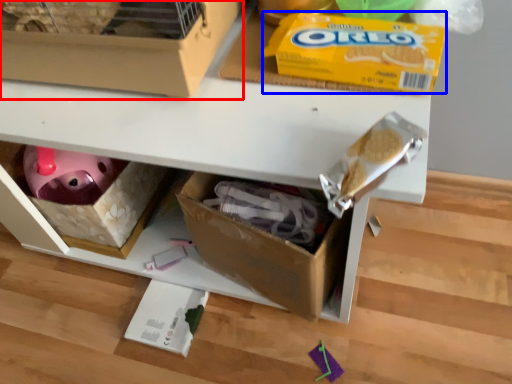
Question: Which object is closer to the camera taking this photo, box (highlighted by a red box) or cereal (highlighted by a blue box)?

Choices:
 (A) box
 (B) cereal

Answer: (A)